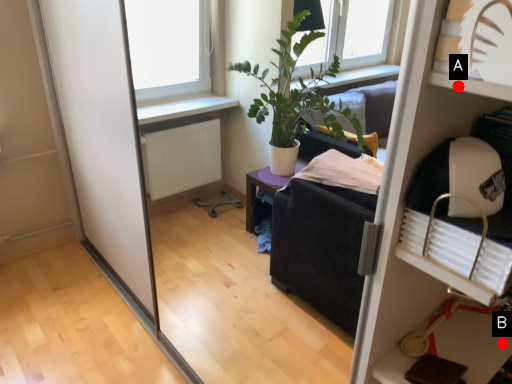
Question: Two points are circled on the image, labeled by A and B beside each circle. Which point is farther from the camera taking this photo?

Choices:
 (A) A is further
 (B) B is further

Answer: (B)